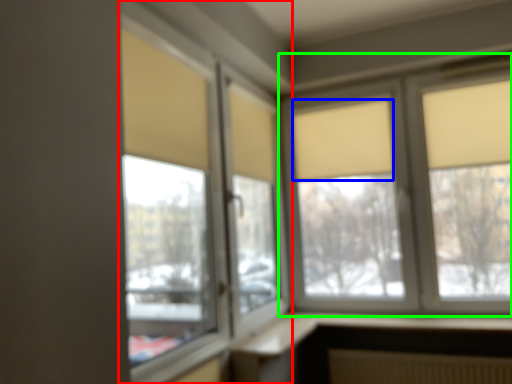
Question: Which object is positioned farthest from window (highlighted by a red box)? Select from curtain (highlighted by a blue box) and window (highlighted by a green box).

Choices:
 (A) curtain
 (B) window

Answer: (B)